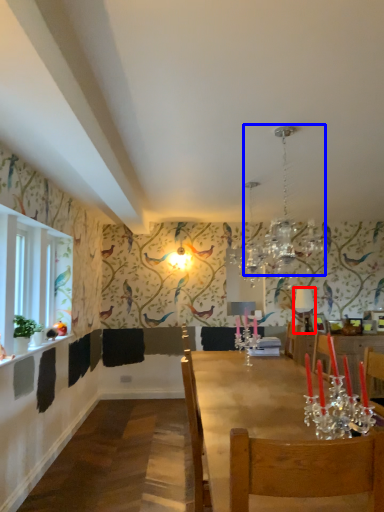
Question: Which of the following is the closest to the observer, lamp (highlighted by a red box) or light fixture (highlighted by a blue box)?

Choices:
 (A) lamp
 (B) light fixture

Answer: (B)